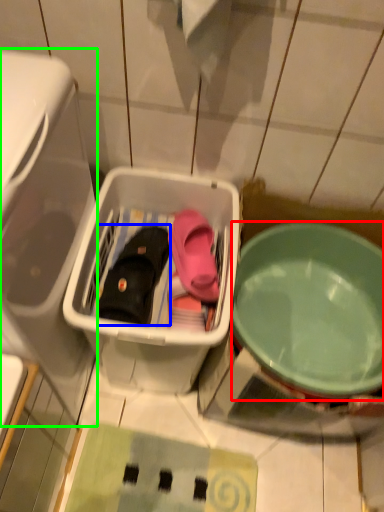
Question: Based on their relative distances, which object is nearer to bowl (highlighted by a red box)? Choose from footwear (highlighted by a blue box) and dish washer (highlighted by a green box).

Choices:
 (A) footwear
 (B) dish washer

Answer: (A)